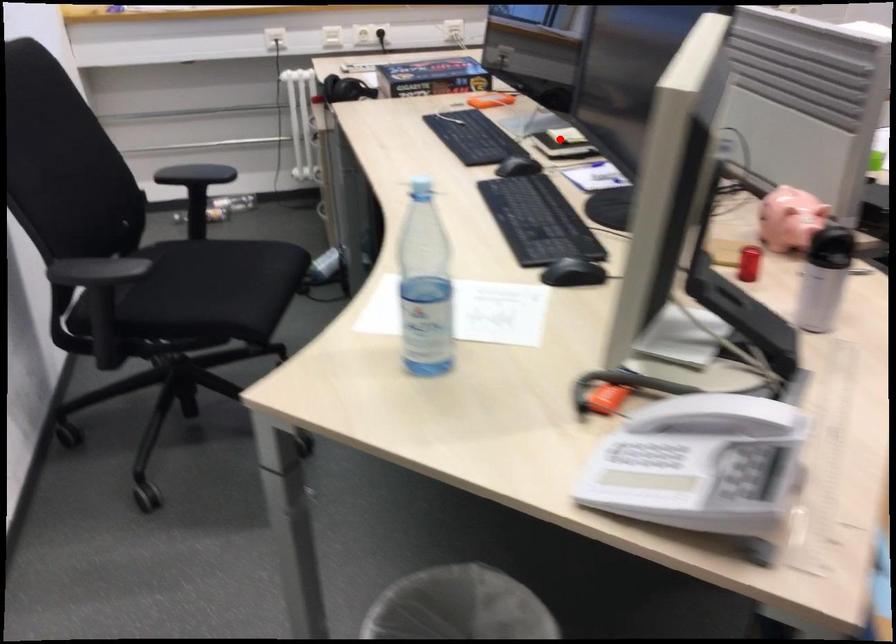
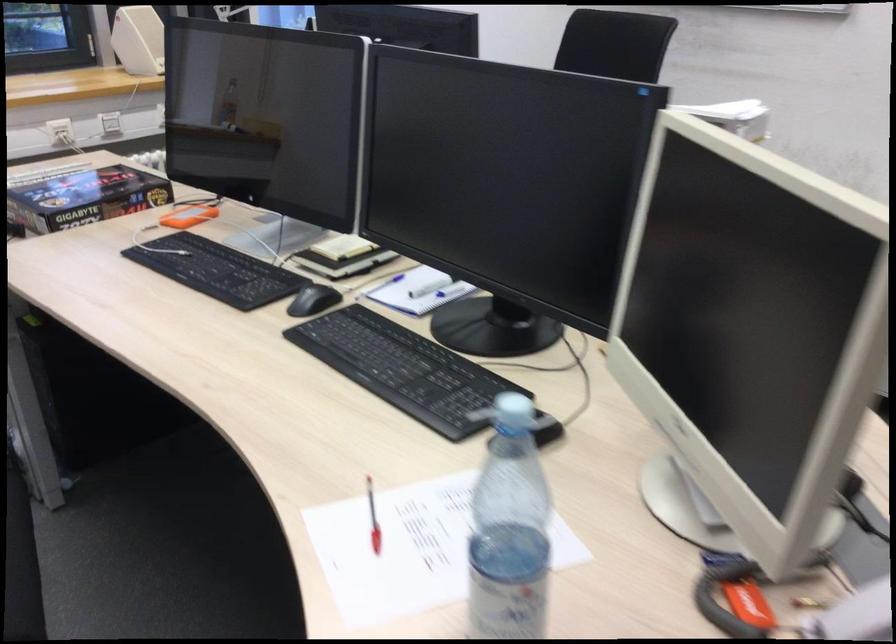
Question: I am providing you with two images of the same scene from different viewpoints. Image1 has a red point marked. In image2, the corresponding 3D location appears at what relative position? Reply with the corresponding letter.

Choices:
 (A) Closer
 (B) Farther

Answer: (A)